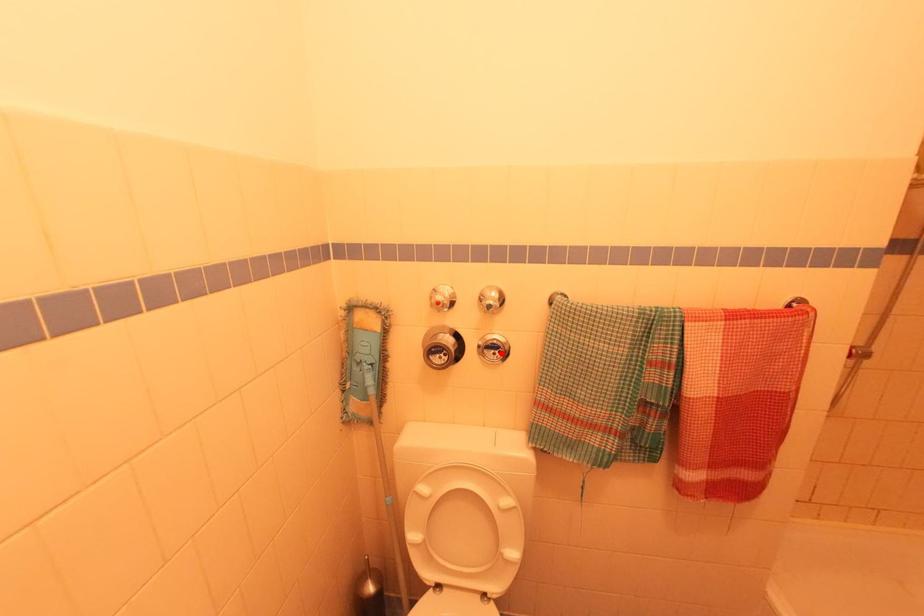
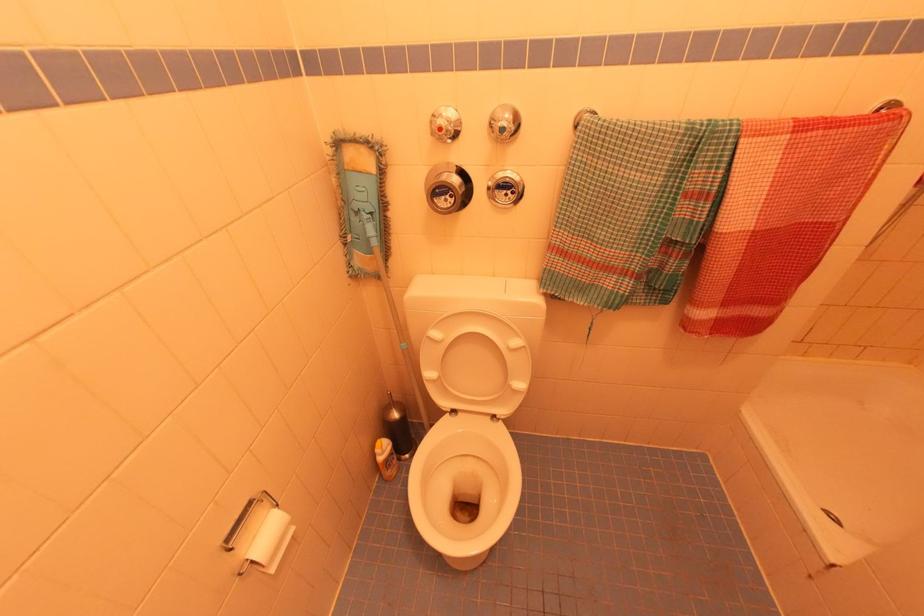
In the second image, find the point that corresponds to the highlighted location in the first image.

(515, 193)